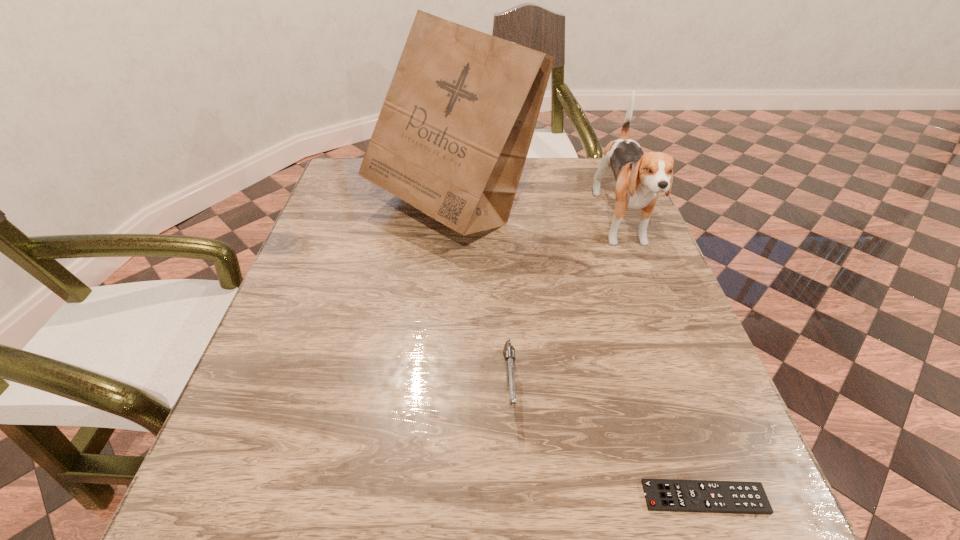
In the image, there is a desktop. At what (x,y) coordinates should I click in order to perform the action: click on free space at the near edge. Please return your answer as a coordinate pair (x, y). Image resolution: width=960 pixels, height=540 pixels. Looking at the image, I should click on (545, 539).

Identify the location of vacant space at the left edge. The height and width of the screenshot is (540, 960). (346, 290).

In the image, there is a desktop. At what (x,y) coordinates should I click in order to perform the action: click on vacant region at the right edge. Please return your answer as a coordinate pair (x, y). Looking at the image, I should click on click(x=629, y=224).

This screenshot has width=960, height=540. I want to click on vacant space at the far left corner of the desktop, so click(369, 197).

This screenshot has height=540, width=960. In the image, there is a desktop. Find the location of `blank space at the far right corner`. blank space at the far right corner is located at coordinates (568, 183).

Image resolution: width=960 pixels, height=540 pixels. I want to click on vacant space that's between the remote control and the grocery bag, so click(578, 354).

Where is `free spot between the shortest object and the tallest object`? The width and height of the screenshot is (960, 540). free spot between the shortest object and the tallest object is located at coordinates (578, 354).

Where is `vacant region between the puppy and the tallest object`? This screenshot has width=960, height=540. vacant region between the puppy and the tallest object is located at coordinates (537, 217).

This screenshot has width=960, height=540. Find the location of `empty space that is in between the remote control and the second nearest object`. empty space that is in between the remote control and the second nearest object is located at coordinates (607, 440).

Image resolution: width=960 pixels, height=540 pixels. What are the coordinates of `empty location between the puppy and the grocery bag` in the screenshot? It's located at (537, 217).